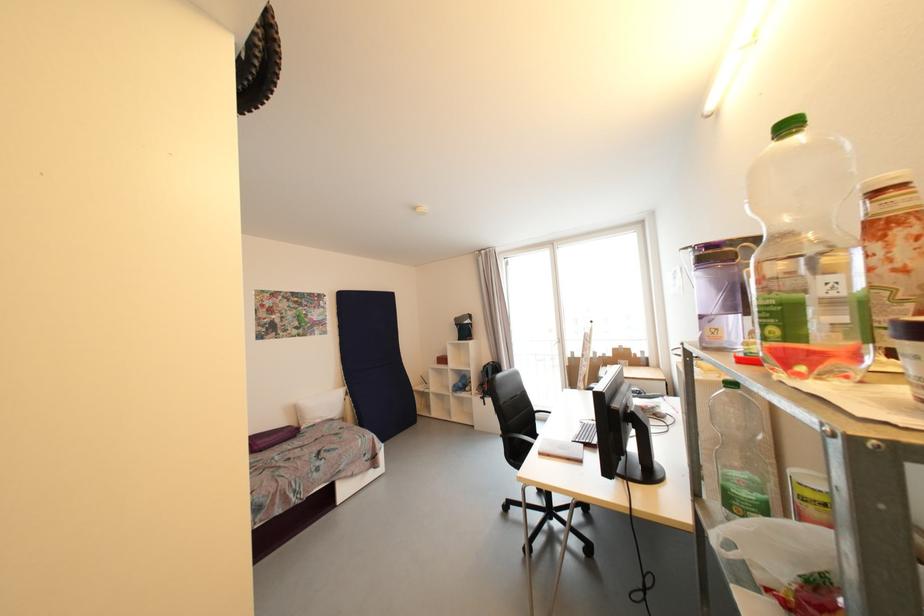
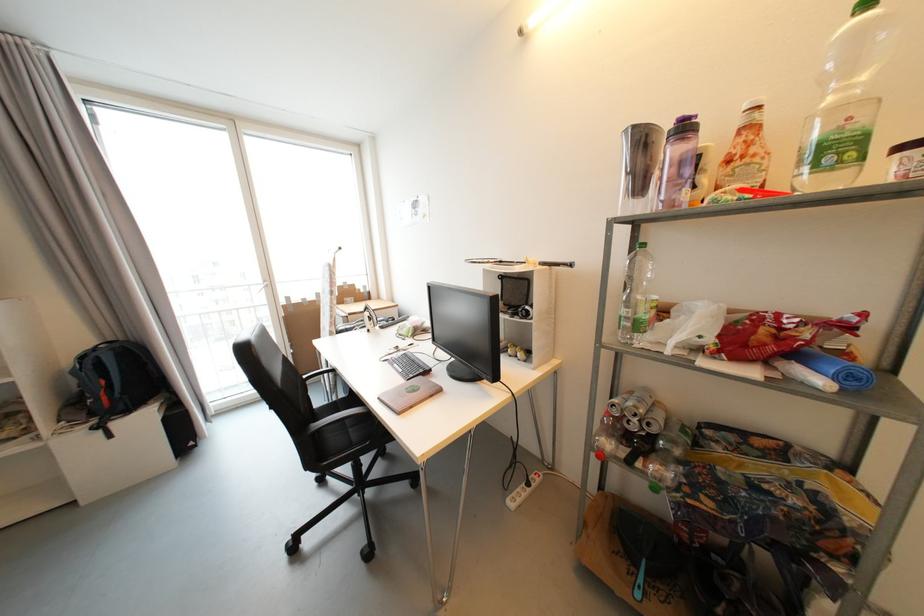
Question: The first image is from the beginning of the video and the second image is from the end. How did the camera likely rotate when shooting the video?

Choices:
 (A) Left
 (B) Right
 (C) Up
 (D) Down

Answer: (B)